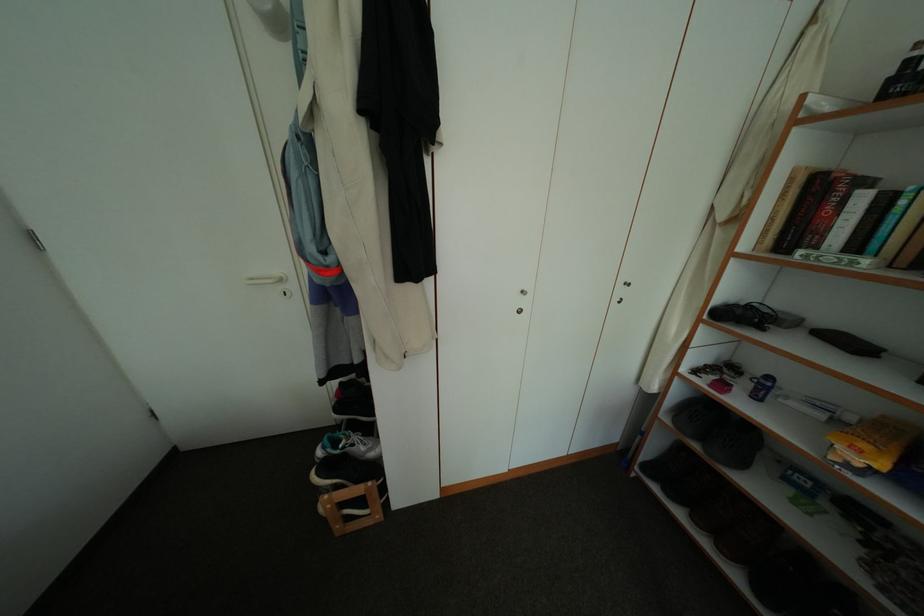
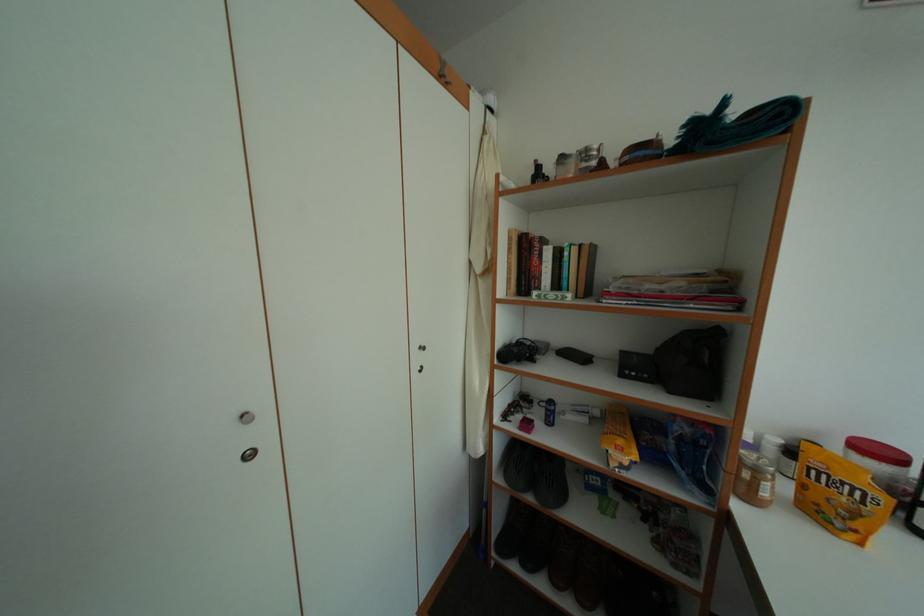
Question: The images are taken continuously from a first-person perspective. In which direction is your viewpoint rotating?

Choices:
 (A) Left
 (B) Right
 (C) Up
 (D) Down

Answer: (B)